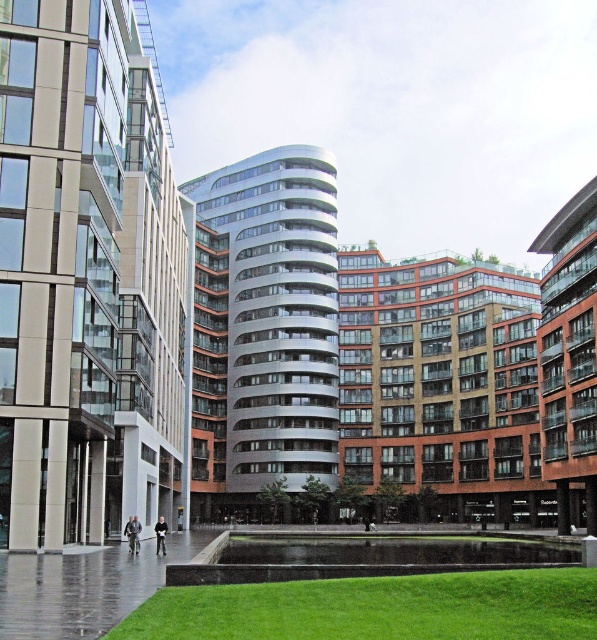
Can you confirm if green grass at lower center is taller than light gray fabric jacket at lower center?

In fact, green grass at lower center may be shorter than light gray fabric jacket at lower center.

Does green grass at lower center come behind light gray fabric jacket at lower center?

No, green grass at lower center is in front of light gray fabric jacket at lower center.

Image resolution: width=597 pixels, height=640 pixels. In order to click on green grass at lower center in this screenshot , I will do `click(377, 608)`.

Locate an element on the screen. The image size is (597, 640). green grass at lower center is located at coordinates (377, 608).

Is light gray fabric jacket at lower center taller than dark gray jacket at center?

Incorrect, light gray fabric jacket at lower center's height is not larger of dark gray jacket at center's.

From the picture: Is light gray fabric jacket at lower center below dark gray jacket at center?

Incorrect, light gray fabric jacket at lower center is not positioned below dark gray jacket at center.

Which is behind, point (134, 540) or point (158, 532)?

Point (158, 532)

Identify the location of light gray fabric jacket at lower center. (133, 532).

Which is more to the right, green grass at lower center or dark gray jacket at center?

From the viewer's perspective, green grass at lower center appears more on the right side.

Who is positioned more to the left, green grass at lower center or dark gray jacket at center?

Positioned to the left is dark gray jacket at center.

In order to click on green grass at lower center in this screenshot , I will do `click(377, 608)`.

This screenshot has width=597, height=640. What are the coordinates of `green grass at lower center` in the screenshot? It's located at (377, 608).